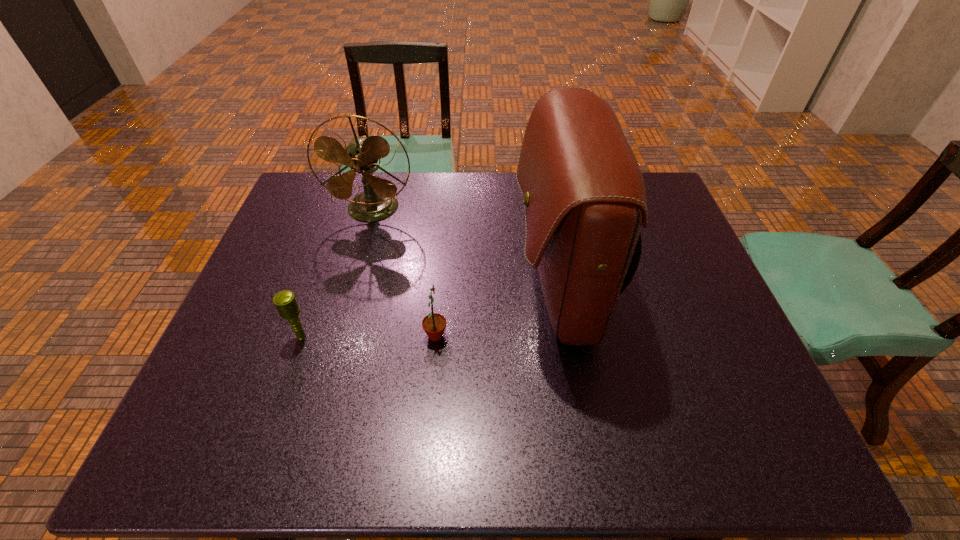
Locate an element on the screen. The width and height of the screenshot is (960, 540). satchel is located at coordinates (584, 195).

At what (x,y) coordinates should I click in order to perform the action: click on the rightmost object. Please return your answer as a coordinate pair (x, y). The image size is (960, 540). Looking at the image, I should click on (584, 195).

You are a GUI agent. You are given a task and a screenshot of the screen. Output one action in this format:
    pyautogui.click(x=<x>, y=<y>)
    Task: Click on the farthest object
    The height and width of the screenshot is (540, 960).
    Given the screenshot: What is the action you would take?
    pyautogui.click(x=378, y=201)

Locate an element on the screen. The image size is (960, 540). the second tallest object is located at coordinates (378, 201).

The height and width of the screenshot is (540, 960). Find the location of `the second object from right to left`. the second object from right to left is located at coordinates (434, 324).

Locate an element on the screen. This screenshot has width=960, height=540. sunflower is located at coordinates (434, 324).

Where is `microphone`? microphone is located at coordinates (285, 301).

Where is `vacant space positioned 0.080m on the open flap of the rightmost object`? This screenshot has height=540, width=960. vacant space positioned 0.080m on the open flap of the rightmost object is located at coordinates (483, 288).

Locate an element on the screen. The width and height of the screenshot is (960, 540). vacant space located 0.200m on the open flap of the rightmost object is located at coordinates (438, 288).

Identify the location of vacant space located 0.210m on the open flap of the rightmost object. (434, 288).